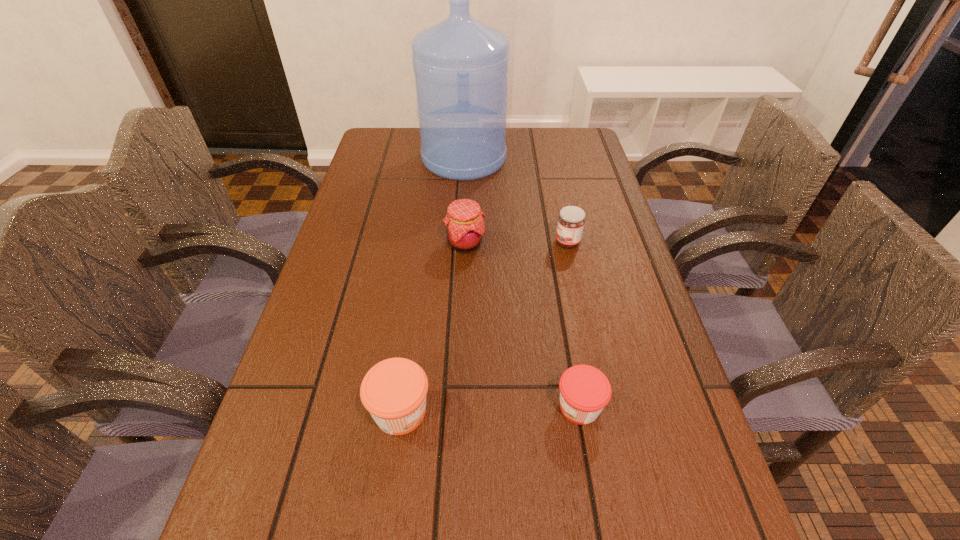
In the image, there is a desktop. At what (x,y) coordinates should I click in order to perform the action: click on vacant space at the right edge. Please return your answer as a coordinate pair (x, y). This screenshot has width=960, height=540. Looking at the image, I should click on (602, 430).

The image size is (960, 540). Find the location of `free space at the far right corner`. free space at the far right corner is located at coordinates (570, 159).

Locate an element on the screen. The height and width of the screenshot is (540, 960). vacant area between the tallest jam and the shortest jam is located at coordinates (522, 325).

This screenshot has height=540, width=960. In order to click on free space between the tallest jam and the shortest object in this screenshot , I will do point(522,325).

Where is `empty space that is in between the second tallest object and the shortest object`? empty space that is in between the second tallest object and the shortest object is located at coordinates (522, 325).

Select which object is the third closest to the shortest object. Please provide its 2D coordinates. Your answer should be formatted as a tuple, i.e. [(x, y)], where the tuple contains the x and y coordinates of a point satisfying the conditions above.

[(571, 220)]

At what (x,y) coordinates should I click in order to perform the action: click on object that is the third closest one to the water jug. Please return your answer as a coordinate pair (x, y). The width and height of the screenshot is (960, 540). Looking at the image, I should click on (394, 391).

Image resolution: width=960 pixels, height=540 pixels. I want to click on the closest jam to the shortest jam, so click(394, 391).

I want to click on jam identified as the third closest to the tallest jam, so click(584, 390).